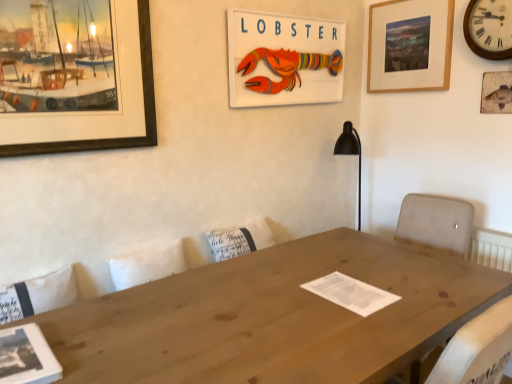
Question: Do you think wooden lobster sign at upper center, acting as the 2th picture frame starting from the left, is within natural wood table at center, or outside of it?

Choices:
 (A) inside
 (B) outside

Answer: (B)

Question: Considering the positions of wooden lobster sign at upper center, acting as the 3th picture frame starting from the right, and natural wood table at center in the image, is wooden lobster sign at upper center, acting as the 3th picture frame starting from the right, bigger or smaller than natural wood table at center?

Choices:
 (A) big
 (B) small

Answer: (B)

Question: Based on their relative distances, which object is farther from the wooden picture frame at upper right, which is counted as the first picture frame, starting from the right?

Choices:
 (A) wooden picture frame at upper left, which is the first picture frame in left-to-right order
 (B) wooden clock at upper right
 (C) wooden picture frame at upper right, marked as the third picture frame in a left-to-right arrangement
 (D) natural wood table at center
 (E) wooden lobster sign at upper center, acting as the 2th picture frame starting from the left

Answer: (A)

Question: Which is farther from the wooden picture frame at upper right, marked as the third picture frame in a left-to-right arrangement?

Choices:
 (A) wooden clock at upper right
 (B) wooden picture frame at upper right, the fourth picture frame in the left-to-right sequence
 (C) wooden lobster sign at upper center, acting as the 3th picture frame starting from the right
 (D) wooden picture frame at upper left, which is the first picture frame in left-to-right order
 (E) natural wood table at center

Answer: (D)